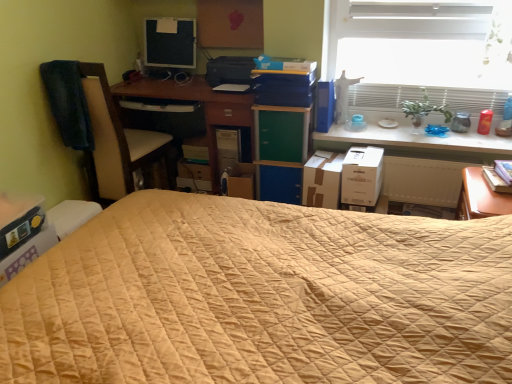
Question: Should I look upward or downward to see matte black monitor at upper left?

Choices:
 (A) up
 (B) down

Answer: (A)

Question: Is matte black computer tower at center further to camera compared to green glossy plant at upper right?

Choices:
 (A) yes
 (B) no

Answer: (A)

Question: Is matte black computer tower at center positioned with its back to green glossy plant at upper right?

Choices:
 (A) yes
 (B) no

Answer: (B)

Question: Does matte black computer tower at center have a greater height compared to green glossy plant at upper right?

Choices:
 (A) no
 (B) yes

Answer: (B)

Question: Can you confirm if matte black computer tower at center is smaller than green glossy plant at upper right?

Choices:
 (A) no
 (B) yes

Answer: (A)

Question: Is matte black computer tower at center positioned beyond the bounds of green glossy plant at upper right?

Choices:
 (A) no
 (B) yes

Answer: (B)

Question: Is matte black computer tower at center positioned before green glossy plant at upper right?

Choices:
 (A) no
 (B) yes

Answer: (A)

Question: Does matte black monitor at upper left come behind cardboard box at lower left, marked as the third cardboard box in a right-to-left arrangement?

Choices:
 (A) no
 (B) yes

Answer: (B)

Question: Is matte black monitor at upper left closer to camera compared to cardboard box at lower left, marked as the third cardboard box in a right-to-left arrangement?

Choices:
 (A) yes
 (B) no

Answer: (B)

Question: Is matte black monitor at upper left bigger than cardboard box at lower left, placed as the 1th cardboard box when sorted from left to right?

Choices:
 (A) no
 (B) yes

Answer: (A)

Question: Does matte black monitor at upper left appear on the left side of cardboard box at lower left, placed as the 1th cardboard box when sorted from left to right?

Choices:
 (A) yes
 (B) no

Answer: (B)

Question: Does matte black monitor at upper left have a lesser width compared to cardboard box at lower left, placed as the 1th cardboard box when sorted from left to right?

Choices:
 (A) no
 (B) yes

Answer: (B)

Question: From a real-world perspective, is matte black monitor at upper left under cardboard box at lower left, placed as the 1th cardboard box when sorted from left to right?

Choices:
 (A) no
 (B) yes

Answer: (A)

Question: Would you consider green matte/blackboard at center, the second paperback book when ordered from left to right, to be distant from white cardboard box at right, the 3th cardboard box when ordered from left to right?

Choices:
 (A) yes
 (B) no

Answer: (B)